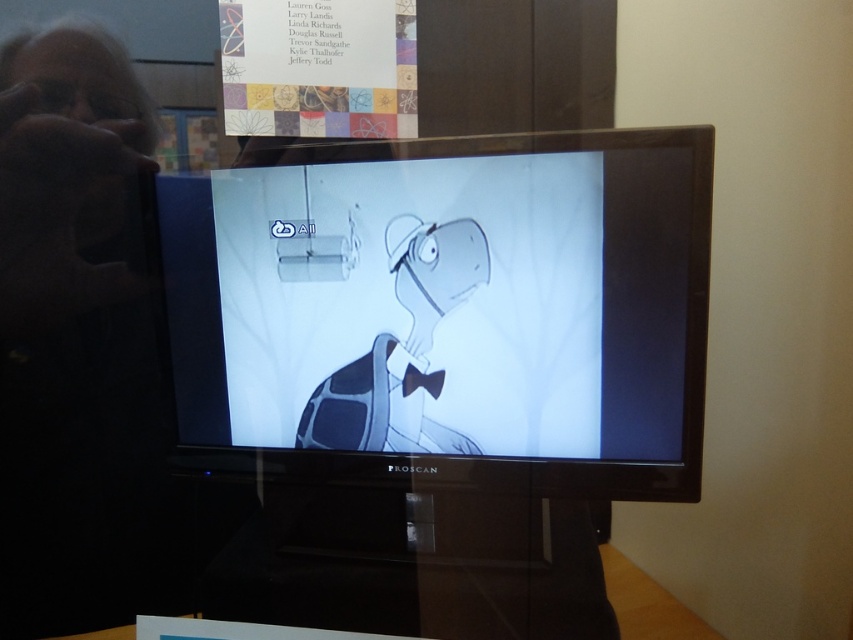
Does matte black screen at center appear under gray matte turtle at center?

Incorrect, matte black screen at center is not positioned below gray matte turtle at center.

Which is in front, point (212, 364) or point (407, 342)?

Positioned in front is point (407, 342).

Locate an element on the screen. matte black screen at center is located at coordinates (450, 310).